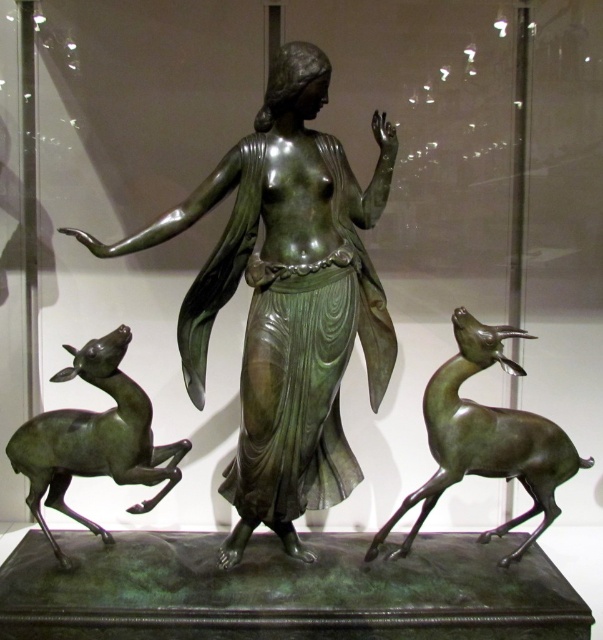
You are a museum visitor standing in front of the green patina bronze statue at center and the green patina deer at right. Which object is nearer to you?

The green patina bronze statue at center is closer to you than the green patina deer at right.